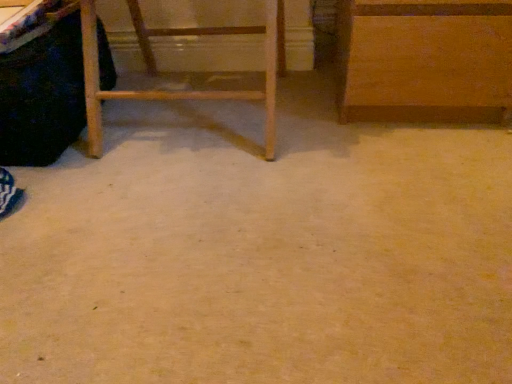
Locate an element on the screen. This screenshot has height=384, width=512. free space in front of wooden ladder at left, the 2th furniture when ordered from right to left is located at coordinates (190, 216).